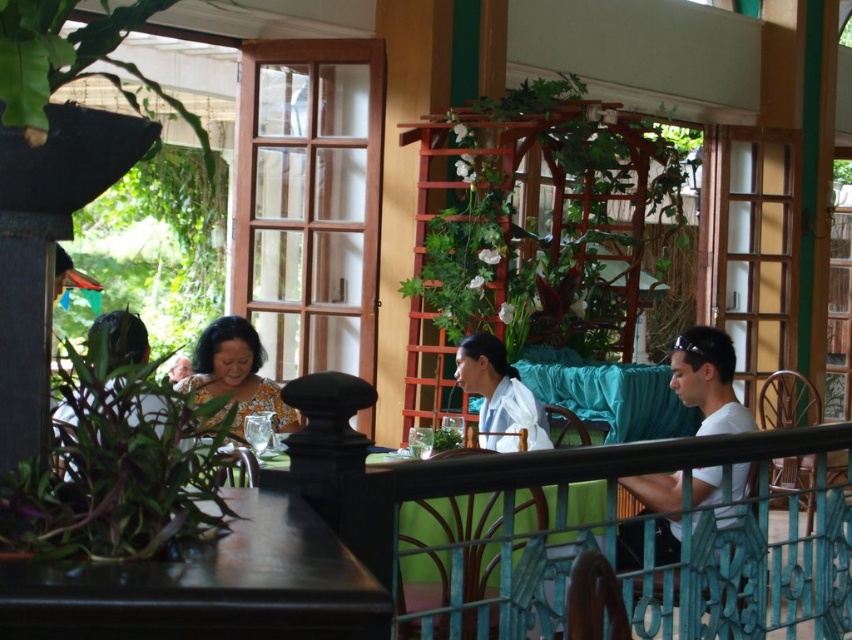
Who is positioned more to the right, printed fabric blouse at center or white fabric shirt at center?

white fabric shirt at center

Is printed fabric blouse at center to the right of white fabric shirt at center from the viewer's perspective?

In fact, printed fabric blouse at center is to the left of white fabric shirt at center.

The image size is (852, 640). Describe the element at coordinates (235, 372) in the screenshot. I see `printed fabric blouse at center` at that location.

The height and width of the screenshot is (640, 852). In order to click on printed fabric blouse at center in this screenshot , I will do `click(235, 372)`.

What do you see at coordinates (208, 586) in the screenshot? I see `dark brown wood table at lower left` at bounding box center [208, 586].

Is the position of dark brown wood table at lower left more distant than that of printed fabric blouse at center?

No, it is not.

Between point (300, 605) and point (258, 369), which one is positioned in front?

Point (300, 605)

The image size is (852, 640). I want to click on dark brown wood table at lower left, so click(208, 586).

The image size is (852, 640). Find the location of `white matte shirt at right`. white matte shirt at right is located at coordinates (707, 380).

What are the coordinates of `white matte shirt at right` in the screenshot? It's located at (707, 380).